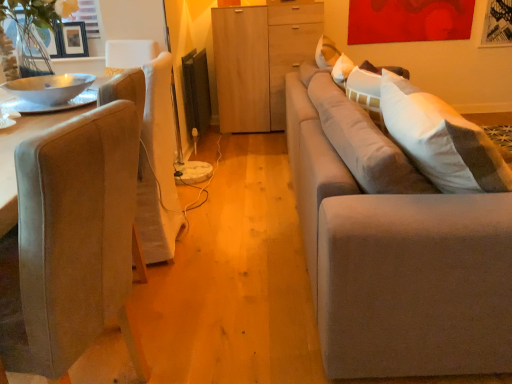
Question: Is white glossy bowl at left surrounding suede gray couch at right?

Choices:
 (A) no
 (B) yes

Answer: (A)

Question: From a real-world perspective, is white glossy bowl at left physically above suede gray couch at right?

Choices:
 (A) no
 (B) yes

Answer: (B)

Question: Is white glossy bowl at left shorter than suede gray couch at right?

Choices:
 (A) no
 (B) yes

Answer: (B)

Question: Does white glossy bowl at left have a lesser width compared to suede gray couch at right?

Choices:
 (A) yes
 (B) no

Answer: (A)

Question: Is white glossy bowl at left with suede gray couch at right?

Choices:
 (A) no
 (B) yes

Answer: (A)

Question: From a real-world perspective, is matte black picture frame at upper left physically located above or below white glossy bowl at left?

Choices:
 (A) below
 (B) above

Answer: (B)

Question: Would you say matte black picture frame at upper left is inside or outside white glossy bowl at left?

Choices:
 (A) outside
 (B) inside

Answer: (A)

Question: From the image's perspective, is matte black picture frame at upper left positioned above or below white glossy bowl at left?

Choices:
 (A) above
 (B) below

Answer: (A)

Question: In terms of height, does matte black picture frame at upper left look taller or shorter compared to white glossy bowl at left?

Choices:
 (A) short
 (B) tall

Answer: (B)

Question: Considering the positions of suede-like beige chair at left and light wood cabinet at center in the image, is suede-like beige chair at left wider or thinner than light wood cabinet at center?

Choices:
 (A) thin
 (B) wide

Answer: (B)

Question: From the image's perspective, is suede-like beige chair at left positioned above or below light wood cabinet at center?

Choices:
 (A) below
 (B) above

Answer: (A)

Question: Visually, is suede-like beige chair at left positioned to the left or to the right of light wood cabinet at center?

Choices:
 (A) left
 (B) right

Answer: (A)

Question: Is suede-like beige chair at left inside or outside of light wood cabinet at center?

Choices:
 (A) outside
 (B) inside

Answer: (A)

Question: Considering the positions of point (426, 344) and point (24, 87), is point (426, 344) closer or farther from the camera than point (24, 87)?

Choices:
 (A) closer
 (B) farther

Answer: (A)

Question: In terms of height, does suede gray couch at right look taller or shorter compared to white glossy bowl at left?

Choices:
 (A) tall
 (B) short

Answer: (A)